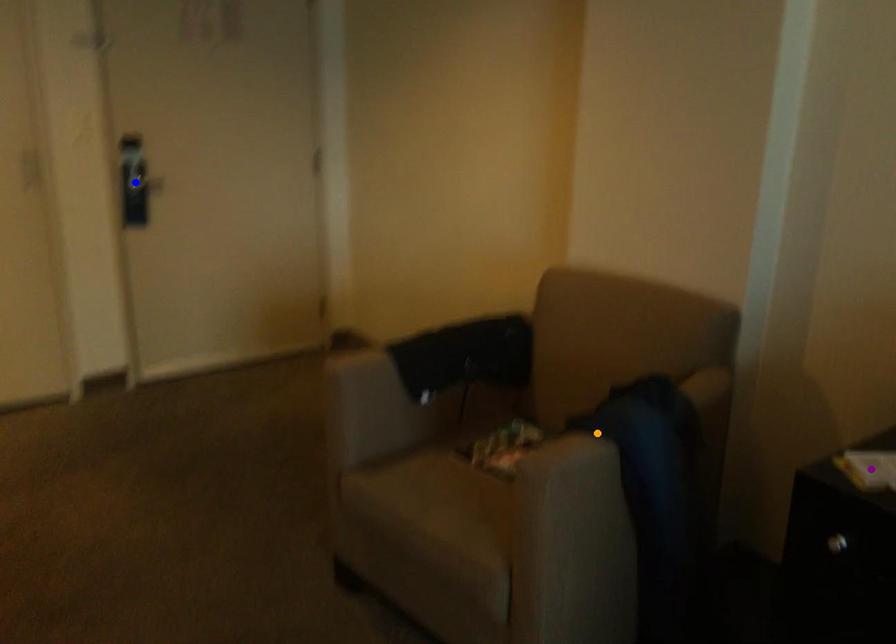
Order these from nearest to farthest:
- purple point
- blue point
- orange point

1. blue point
2. orange point
3. purple point